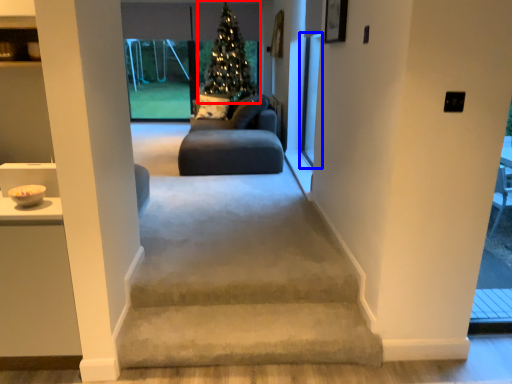
Question: Which object is further to the camera taking this photo, christmas tree (highlighted by a red box) or screen door (highlighted by a blue box)?

Choices:
 (A) christmas tree
 (B) screen door

Answer: (A)